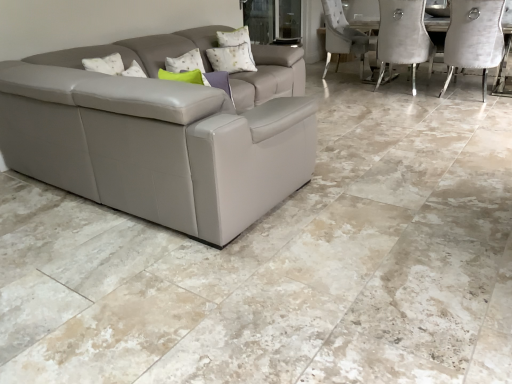
In order to click on free space in front of velvet grey chair at upper right in this screenshot , I will do `click(477, 109)`.